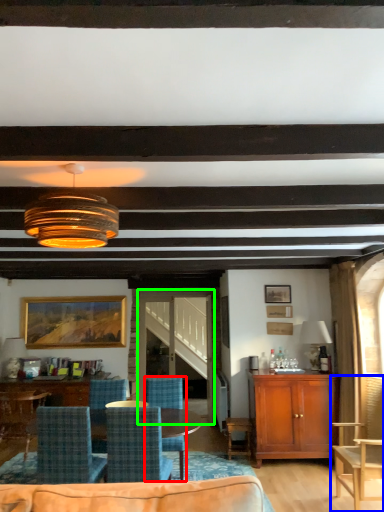
Question: Considering the real-world distances, which object is closest to chair (highlighted by a red box)? chair (highlighted by a blue box) or glass door (highlighted by a green box).

Choices:
 (A) chair
 (B) glass door

Answer: (B)